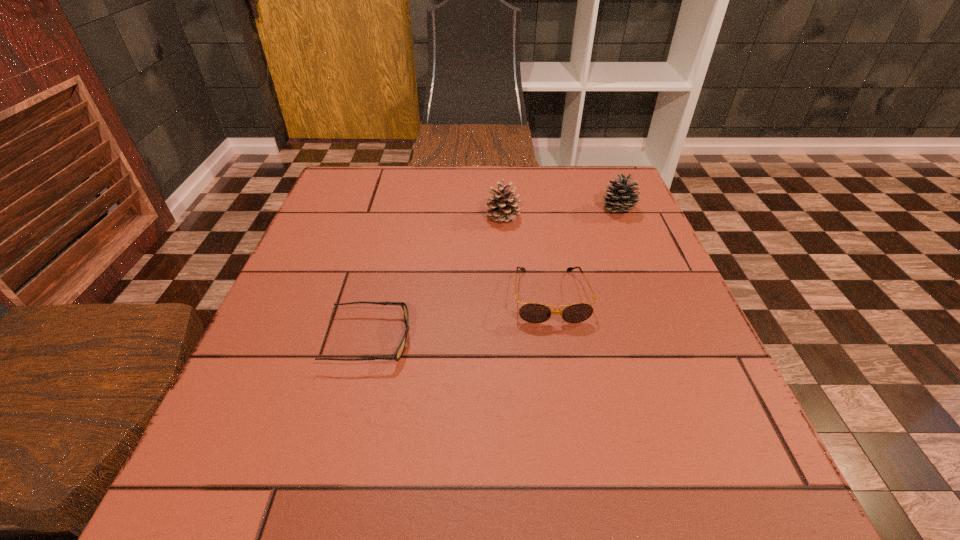
Locate an element on the screen. The image size is (960, 540). the right pinecone is located at coordinates (620, 198).

You are a GUI agent. You are given a task and a screenshot of the screen. Output one action in this format:
    pyautogui.click(x=<x>, y=<y>)
    Task: Click on the left pinecone
    
    Given the screenshot: What is the action you would take?
    pyautogui.click(x=505, y=207)

This screenshot has width=960, height=540. I want to click on the second shortest object, so click(530, 312).

Image resolution: width=960 pixels, height=540 pixels. In order to click on the taller sunglasses in this screenshot , I will do `click(530, 312)`.

You are a GUI agent. You are given a task and a screenshot of the screen. Output one action in this format:
    pyautogui.click(x=<x>, y=<y>)
    Task: Click on the shortest object
    
    Given the screenshot: What is the action you would take?
    pyautogui.click(x=400, y=349)

Where is `the leftmost object`? the leftmost object is located at coordinates (400, 349).

This screenshot has height=540, width=960. I want to click on free space located on the front of the rightmost object, so click(629, 232).

This screenshot has width=960, height=540. In order to click on free space located on the front of the left pinecone in this screenshot , I will do `click(505, 253)`.

Image resolution: width=960 pixels, height=540 pixels. I want to click on vacant space located 0.300m on the lenses of the taller sunglasses, so click(583, 492).

Identify the location of vacant space located on the front-facing side of the shortest object. The height and width of the screenshot is (540, 960). (635, 340).